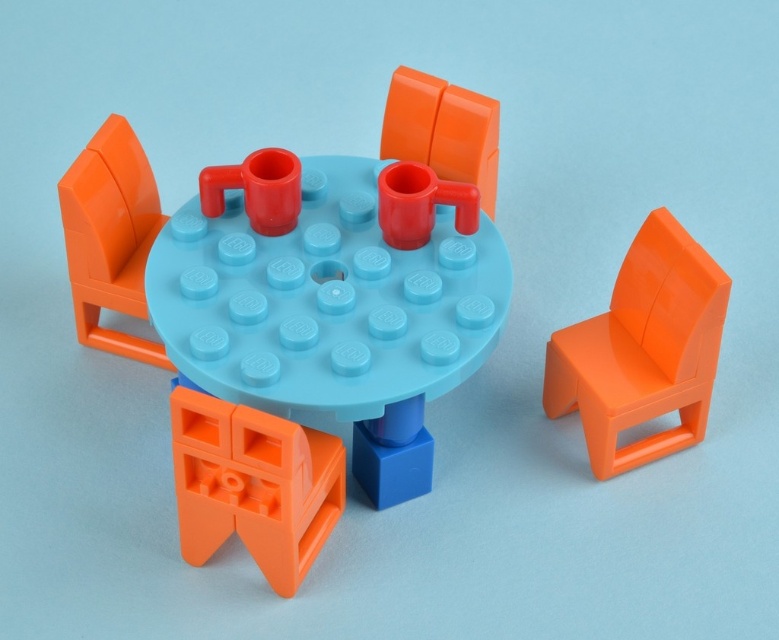
You are a child sitting at the orange glossy chair at right. You want to pass a toy to the friend sitting at the orange matte chair at center. Which direction should you lean to hand it over?

You should lean towards the center because the orange glossy chair at right is closer to the viewer than the orange matte chair at center, meaning the matte chair is further back. To reach them, you need to lean forward towards the center direction.

You are a toy organizer who needs to move a 50 cm wide toy box between the orange glossy chair at right and the orange matte chair at lower left. Can the toy box fit through the space between them?

The distance between the orange glossy chair at right and the orange matte chair at lower left is 46.67 centimeters. Since the toy box is 50 cm wide, it cannot fit through the space between them.